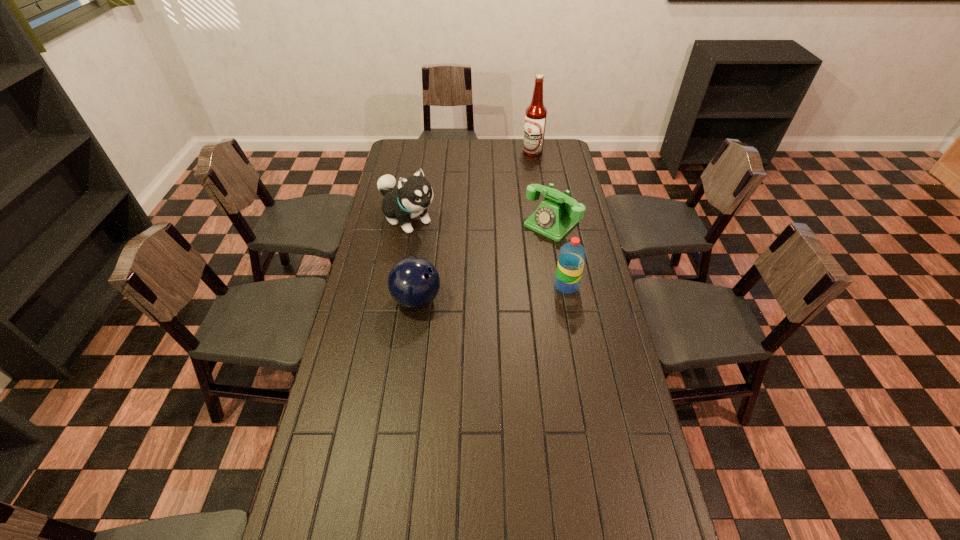
Locate an element on the screen. The width and height of the screenshot is (960, 540). free spot between the puppy and the telephone is located at coordinates (480, 221).

You are a GUI agent. You are given a task and a screenshot of the screen. Output one action in this format:
    pyautogui.click(x=<x>, y=<y>)
    Task: Click on the vacant area between the telephone and the water bottle
    This screenshot has width=960, height=540.
    Given the screenshot: What is the action you would take?
    pyautogui.click(x=559, y=254)

This screenshot has width=960, height=540. What are the coordinates of `free area in between the bowling ball and the water bottle` in the screenshot? It's located at (492, 293).

You are a GUI agent. You are given a task and a screenshot of the screen. Output one action in this format:
    pyautogui.click(x=<x>, y=<y>)
    Task: Click on the free space between the third shortest object and the bowling ball
    This screenshot has height=540, width=960.
    Given the screenshot: What is the action you would take?
    pyautogui.click(x=492, y=293)

Where is `vacant space that's between the puppy and the telephone`? This screenshot has width=960, height=540. vacant space that's between the puppy and the telephone is located at coordinates (480, 221).

The image size is (960, 540). I want to click on free area in between the farthest object and the bowling ball, so click(x=475, y=226).

The image size is (960, 540). Identify the location of vacant space in between the telephone and the puppy. (480, 221).

Point out which object is positioned as the nearest to the water bottle. Please provide its 2D coordinates. Your answer should be formatted as a tuple, i.e. [(x, y)], where the tuple contains the x and y coordinates of a point satisfying the conditions above.

[(554, 218)]

Where is `object that can be found as the third closest to the bowling ball`? The image size is (960, 540). object that can be found as the third closest to the bowling ball is located at coordinates (572, 255).

I want to click on free region that satisfies the following two spatial constraints: 1. on the front side of the third tallest object; 2. on the front label of the telephone, so click(x=563, y=286).